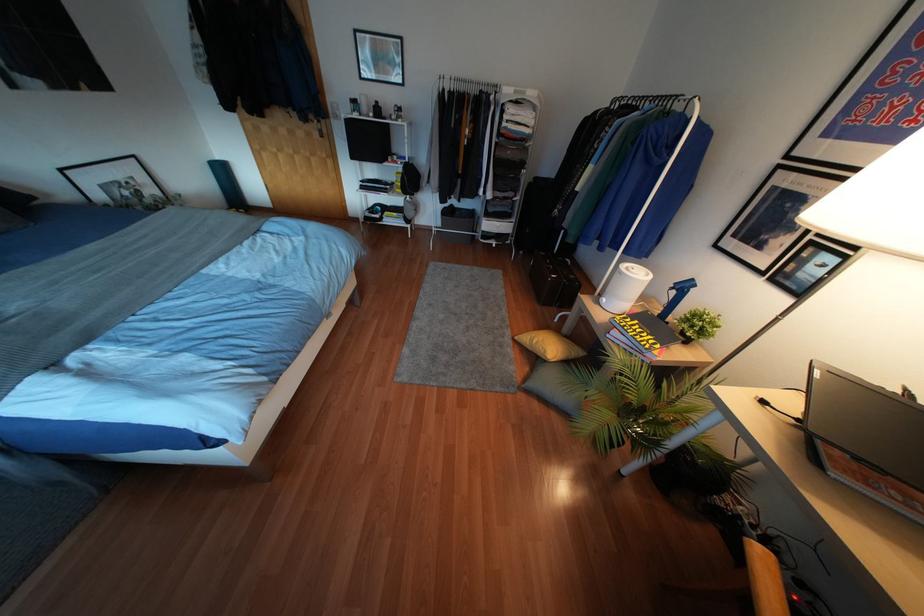
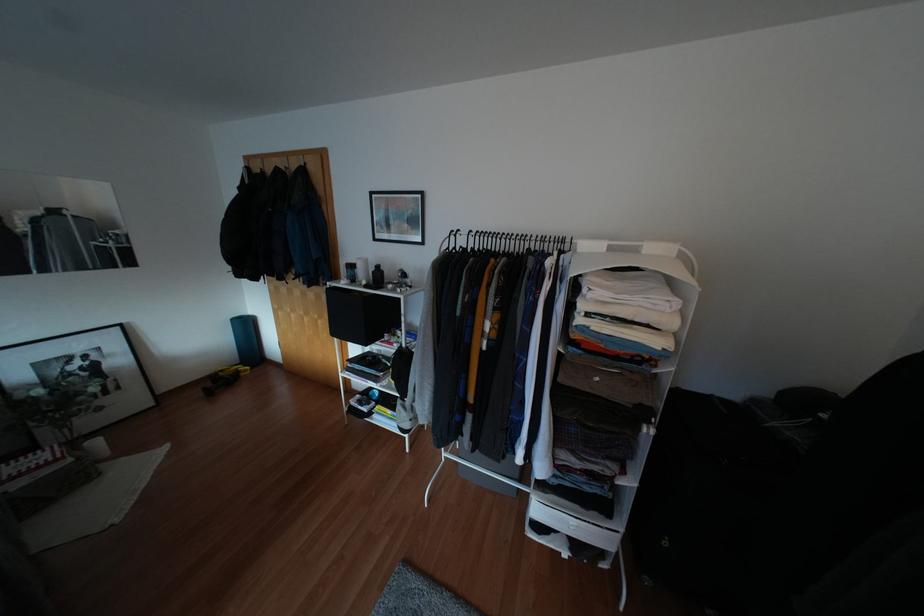
Where in the second image is the point corresponding to point (371, 114) from the first image?

(362, 282)